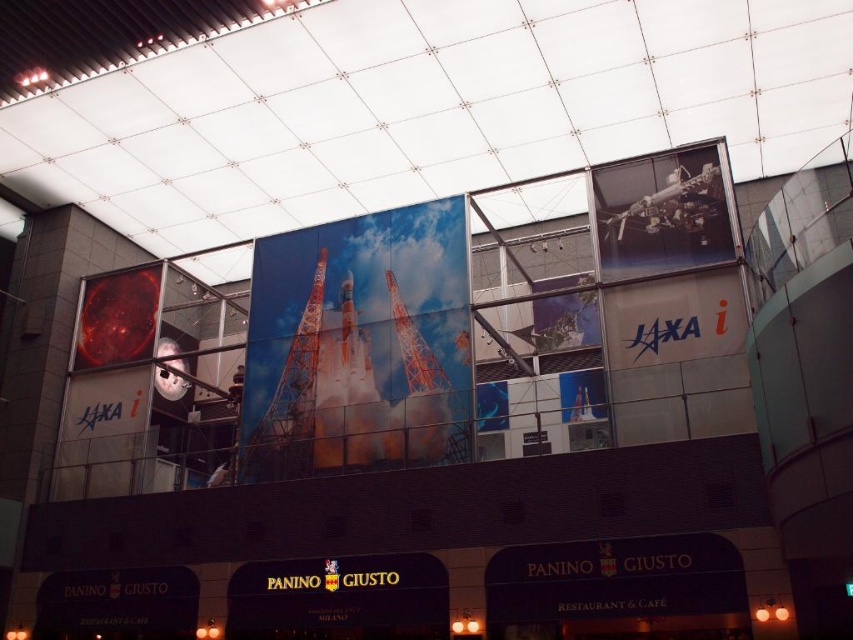
You are designing a poster for a space exhibition and need to include both the orange matte rocket at center and the metallic orange rocket at center. Which rocket takes up more space in the image?

The metallic orange rocket at center takes up more space than the orange matte rocket at center.

You are an architect designing a new building facade. You have two rocket images to choose from for the central display area. The metallic rocket at center and the orange matte rocket at center. Based on the provided scene, which rocket image should you select if you want the central display to have the taller rocket?

The metallic rocket at center is taller than the orange matte rocket at center, so you should select the metallic rocket at center for the central display area if you want the taller rocket.